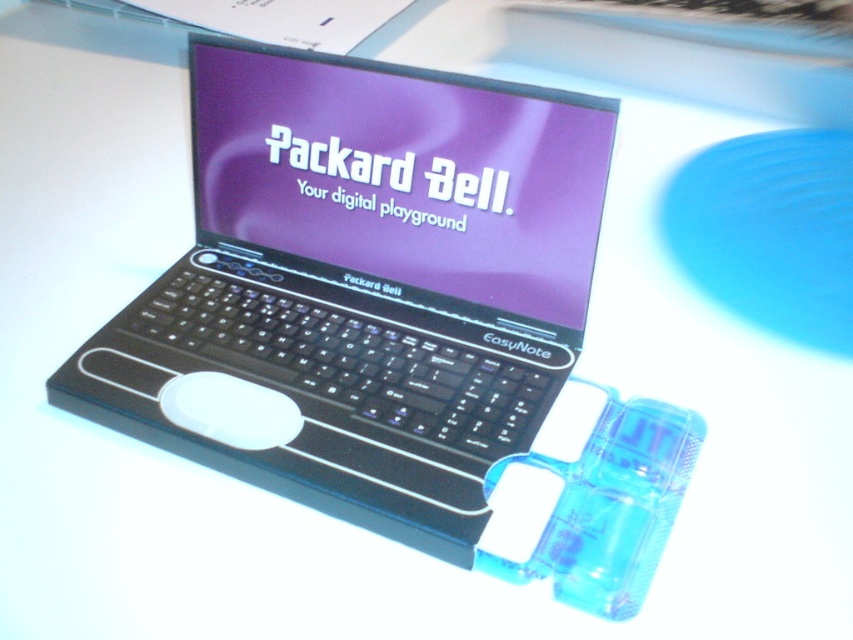
You are setting up a desk for a presentation and need to place both the black plastic laptop at center and the white matte mouse at center. Given that the laptop is taller than the mouse, which item should you avoid placing in a narrow shelf space to prevent blocking the mouse?

You should avoid placing the black plastic laptop at center in the narrow shelf space because it is taller than the white matte mouse at center, which might block the mouse if placed together in a confined area.

You are setting up a desk for a presentation and need to place both the black plastic laptop at center and the white matte mouse at center. Since space is limited, which object should you prioritize placing first to ensure both fit comfortably?

The black plastic laptop at center is larger than the white matte mouse at center, so you should prioritize placing the black plastic laptop at center first to ensure there is enough space for both.

You are setting up a new workspace and want to place the black plastic laptop at center and the white matte mouse at center on your desk. Based on the image, which object is closer to you when both are placed on the desk?

The black plastic laptop at center is closer to you than the white matte mouse at center because it is positioned in front of it in the image.